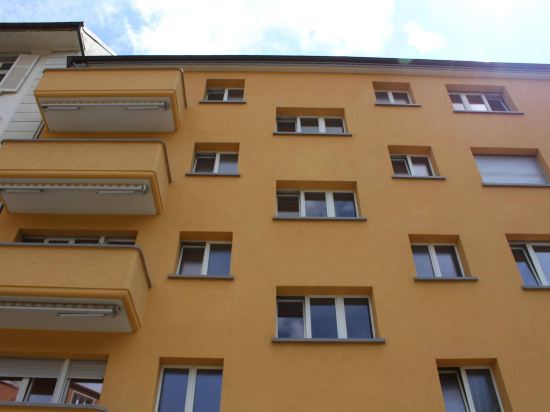
This screenshot has width=550, height=412. Identify the location of bottom most square window. (321, 318).